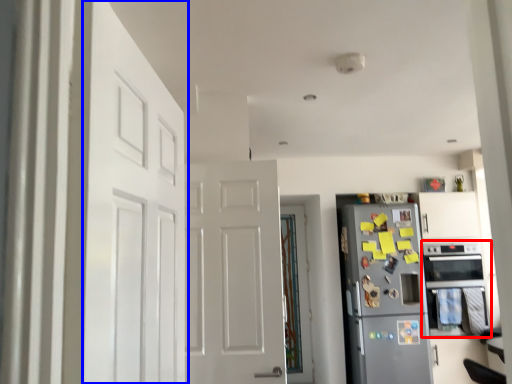
Question: Which object is closer to the camera taking this photo, oven (highlighted by a red box) or door (highlighted by a blue box)?

Choices:
 (A) oven
 (B) door

Answer: (B)